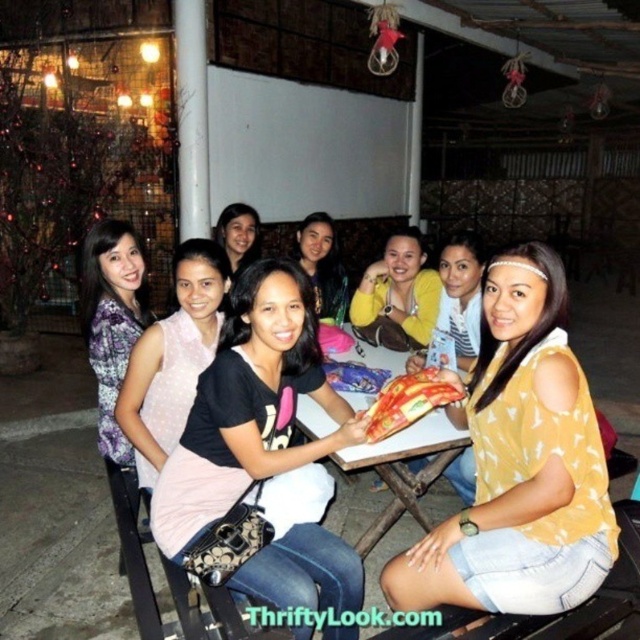
Question: Which point is closer to the camera taking this photo?

Choices:
 (A) 358,467
 (B) 396,288
 (C) 560,458
 (D) 323,257

Answer: (C)

Question: Does matte black dress at center appear on the left side of plaid fabric blouse at left?

Choices:
 (A) yes
 (B) no

Answer: (B)

Question: Does plaid fabric blouse at left come in front of yellow matte sweater at center?

Choices:
 (A) no
 (B) yes

Answer: (B)

Question: Is plaid fabric blouse at left to the left of white plastic table at center from the viewer's perspective?

Choices:
 (A) no
 (B) yes

Answer: (B)

Question: Based on their relative distances, which object is farther from the black cotton shirt at center?

Choices:
 (A) white plastic table at center
 (B) yellow matte sweater at center
 (C) yellow printed top at center

Answer: (B)

Question: Which of these objects is positioned closest to the matte black dress at center?

Choices:
 (A) yellow printed top at center
 (B) yellow matte shirt at center
 (C) black cotton shirt at center

Answer: (C)